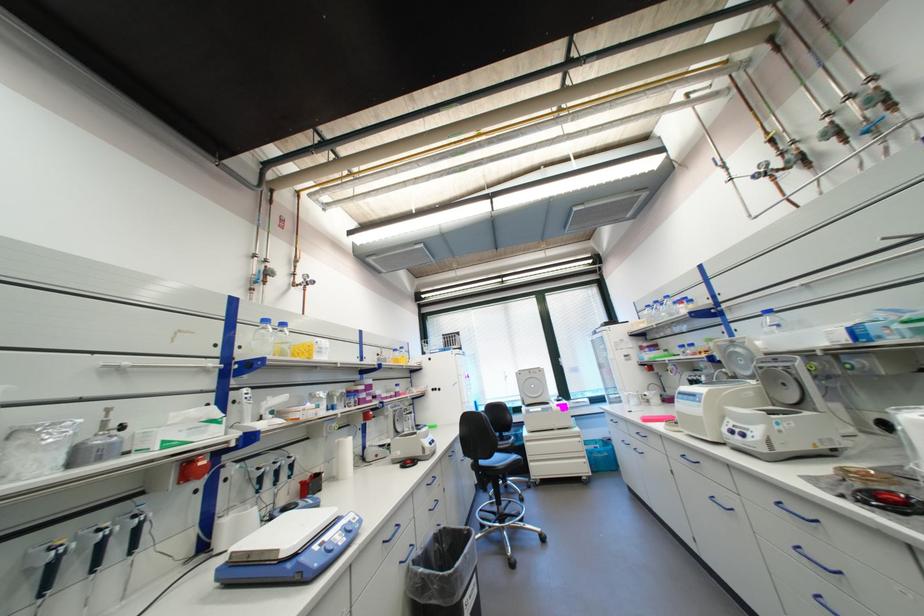
Where would you clos the centrifuge lid? Please return your answer as a coordinate pair (x, y).

(787, 383)